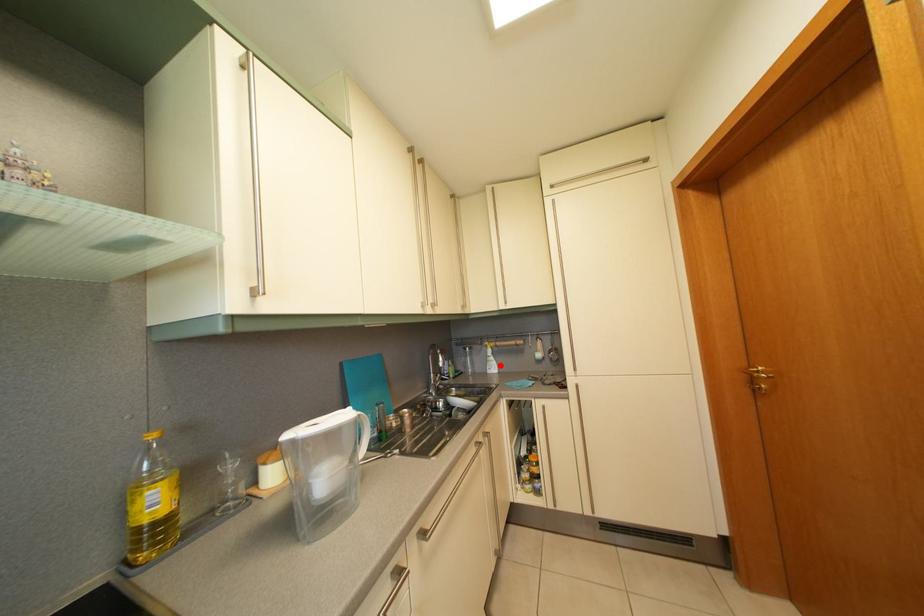
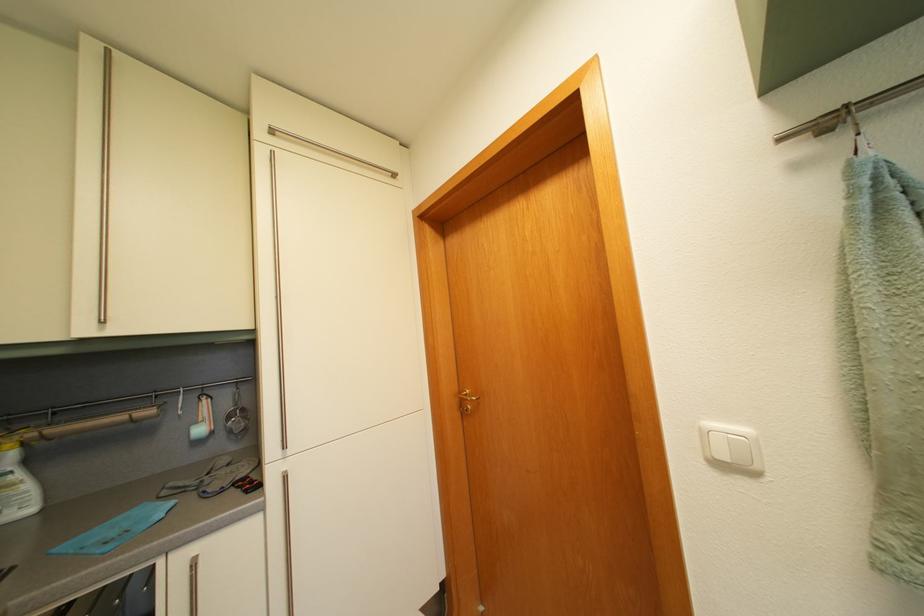
Question: A red point is marked in image1. In image2, is the corresponding 3D point closer to the camera or farther? Reply with the corresponding letter.

Choices:
 (A) The corresponding 3D point is closer.
 (B) The corresponding 3D point is farther.

Answer: (A)